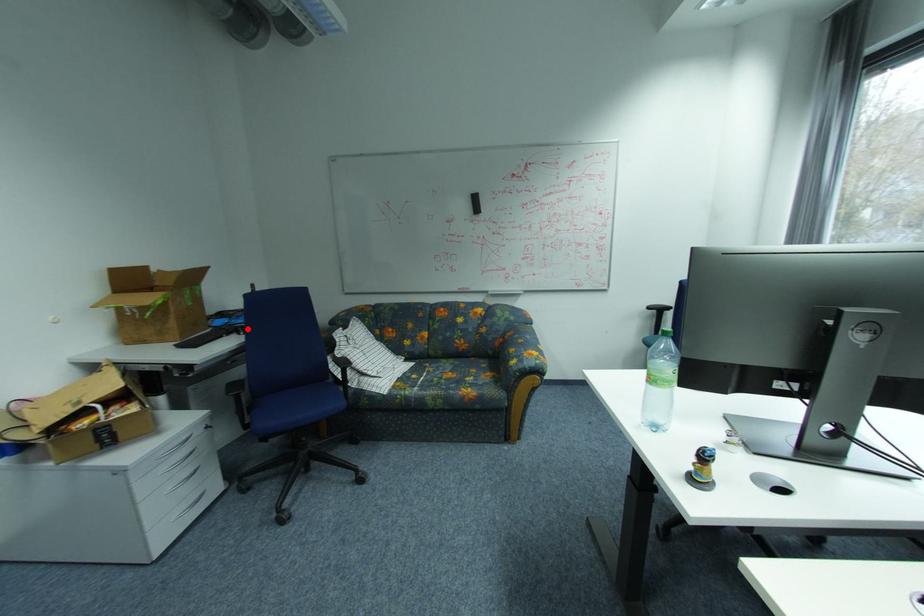
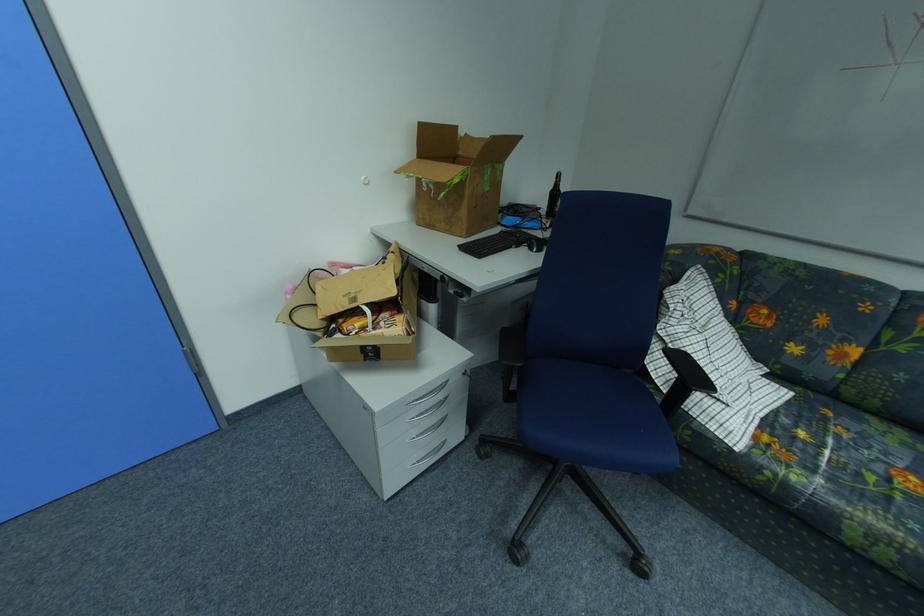
The point at the highlighted location is marked in the first image. Where is the corresponding point in the second image?

(541, 241)